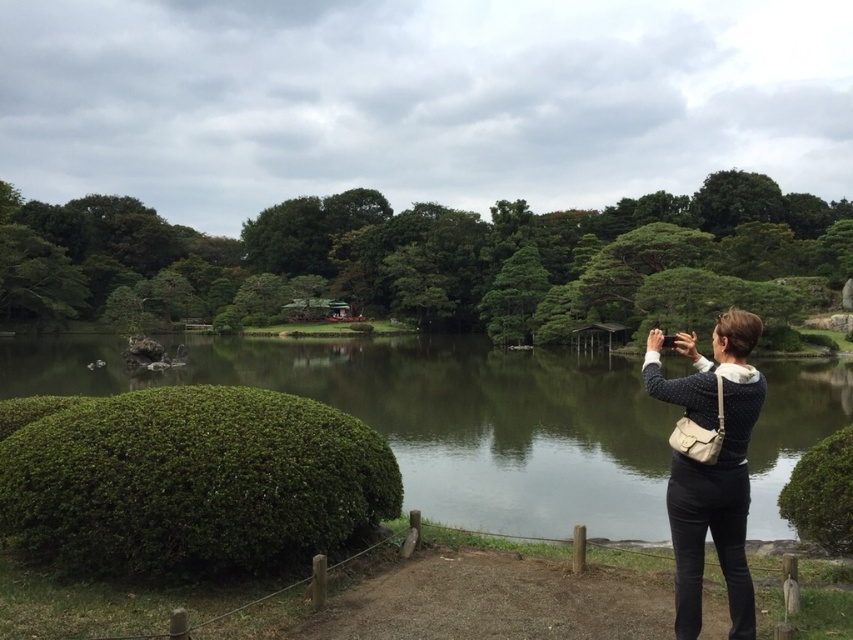
You are standing at the point marked as point (x=189, y=480) in the image. What is the nearest object to you in the scene?

The nearest object to you at point (x=189, y=480) is the green bushy hedge at lower left since the point is located on it.

You are standing at the center of the dirt path and want to take a photo of both the point at coordinates (225, 461) and the point at coordinates (839, 468). Which point should you focus on first to ensure both are in the frame?

You should focus on the point at coordinates (225, 461) first because it is in front of the point at coordinates (839, 468), so it will be closer to your camera position.